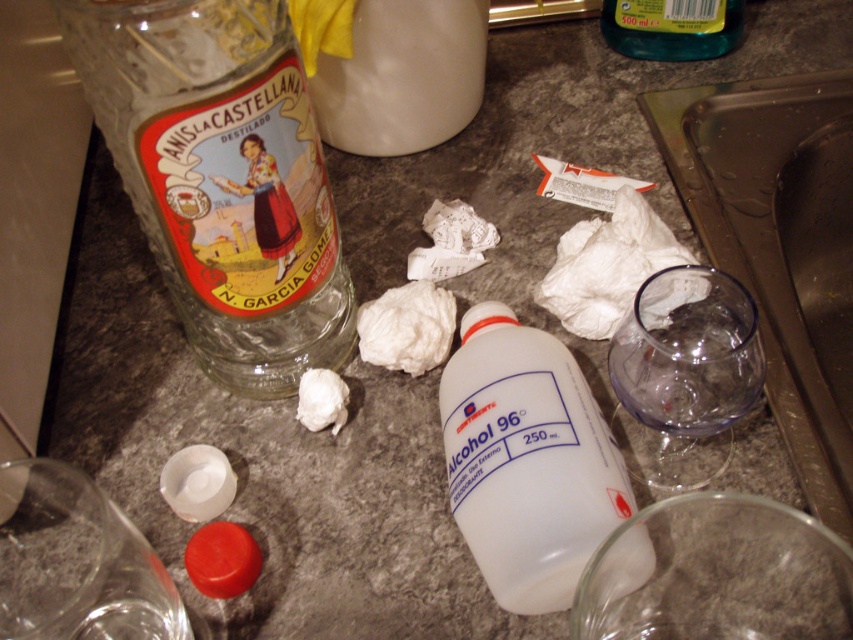
You are a delivery person who just arrived at the kitchen. You need to place a new package on the kitchen countertop, but you want to ensure there is enough space. The package is 12 inches long. Is there enough space between the transparent glass bottle at upper left and the edge of the countertop to place the package?

The transparent glass bottle at upper left is 13.14 inches from the viewer. Since the package is 12 inches long, there is enough space between the transparent glass bottle at upper left and the edge of the countertop to place the package because 13.14 inches is greater than 12 inches.

You are organizing the clutter on the kitchen countertop and need to place a green translucent bottle at upper right behind the white crumpled paper at center. Is the current arrangement already meeting this requirement?

The white crumpled paper at center is in front of the green translucent bottle at upper right, so the current arrangement already has the green translucent bottle at upper right placed behind the white crumpled paper at center.

You are trying to reach for the transparent glass bottle at upper left and the white fabric at center. Which object is easier to grab without moving your hand too much?

The transparent glass bottle at upper left is closer to the viewer than the white fabric at center, so it is easier to grab without moving your hand too much.